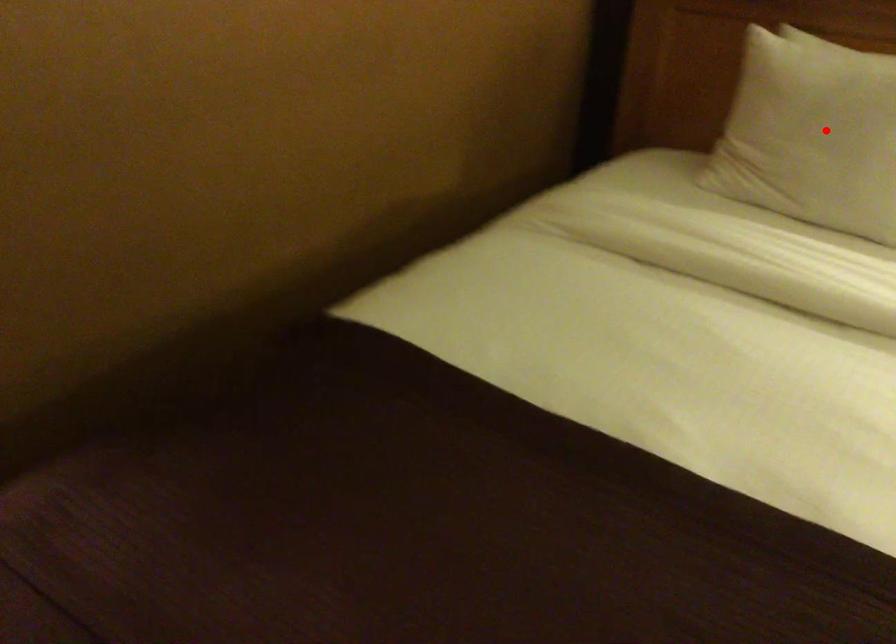
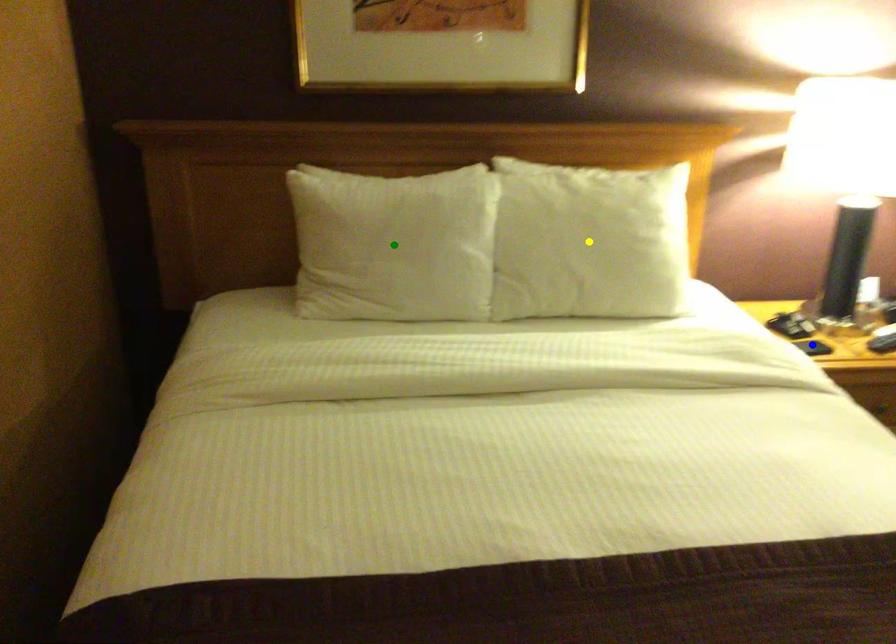
Question: I am providing you with two images of the same scene from different viewpoints. A red point is marked on the first image. You are given multiple points on the second image. Can you choose the point in image 2 that corresponds to the point in image 1?

Choices:
 (A) yellow point
 (B) blue point
 (C) green point

Answer: (C)